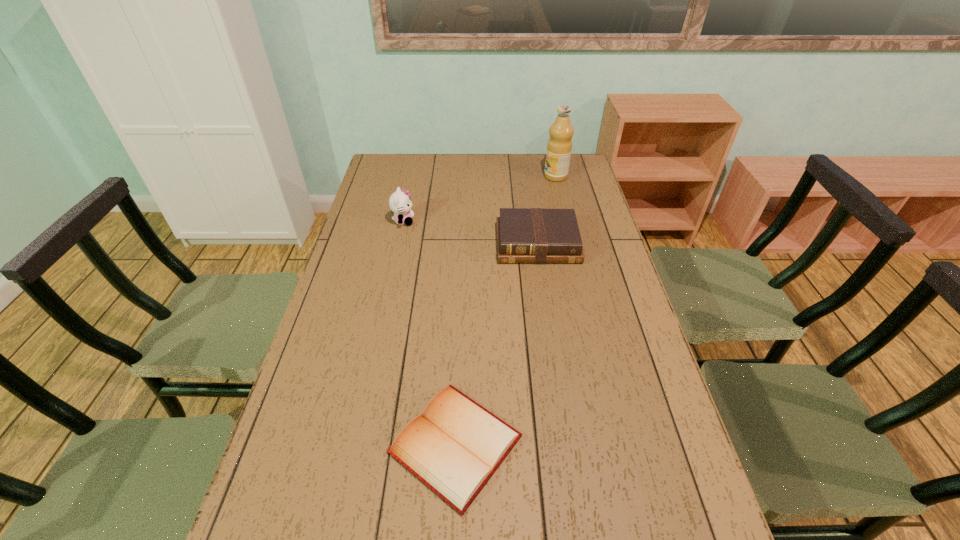
Identify the location of free spot at the left edge of the desktop. (379, 187).

In order to click on vacant area at the right edge in this screenshot , I will do `click(590, 254)`.

Find the location of a particular element. vacant space at the far left corner is located at coordinates (383, 163).

Identify the location of free point between the leftmost object and the nearest object. (429, 333).

Locate an element on the screen. The height and width of the screenshot is (540, 960). vacant area between the kitten and the shortest object is located at coordinates (429, 333).

Where is `free space between the shortest object and the second tallest object`? This screenshot has width=960, height=540. free space between the shortest object and the second tallest object is located at coordinates (429, 333).

Identify the location of free space between the farther Bible and the leftmost object. (470, 232).

Where is `empty space between the second tallest object and the nearest object`? empty space between the second tallest object and the nearest object is located at coordinates (429, 333).

At what (x,y) coordinates should I click in order to perform the action: click on free space between the farther Bible and the leftmost object. Please return your answer as a coordinate pair (x, y). This screenshot has height=540, width=960. Looking at the image, I should click on (470, 232).

In order to click on free space between the shortest object and the tallest object in this screenshot , I will do `click(506, 310)`.